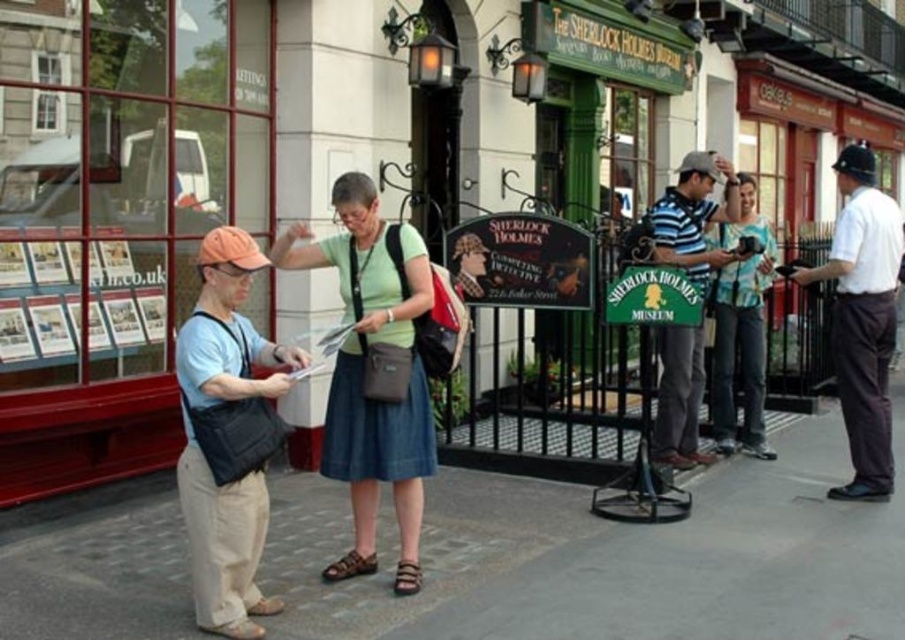
Question: Which object is positioned farthest from the striped polo shirt at center?

Choices:
 (A) teal jersey at center
 (B) matte black bag at left
 (C) green fabric skirt at center

Answer: (B)

Question: Estimate the real-world distances between objects in this image. Which object is closer to the gray concrete pavement at center?

Choices:
 (A) striped polo shirt at center
 (B) teal jersey at center
 (C) white cotton shirt at right
 (D) green fabric skirt at center

Answer: (D)

Question: Is gray concrete pavement at center smaller than green fabric skirt at center?

Choices:
 (A) yes
 (B) no

Answer: (A)

Question: Where is gray concrete pavement at center located in relation to teal jersey at center in the image?

Choices:
 (A) right
 (B) left

Answer: (B)

Question: Does matte black bag at left have a greater width compared to teal jersey at center?

Choices:
 (A) yes
 (B) no

Answer: (B)

Question: Which of the following is the farthest from the observer?

Choices:
 (A) (665, 625)
 (B) (846, 253)
 (C) (384, 340)

Answer: (B)